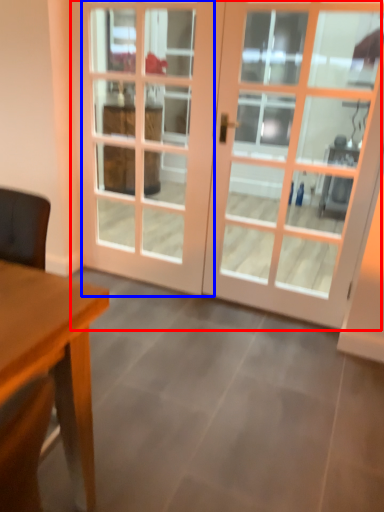
Question: Which object is further to the camera taking this photo, door (highlighted by a red box) or screen door (highlighted by a blue box)?

Choices:
 (A) door
 (B) screen door

Answer: (B)